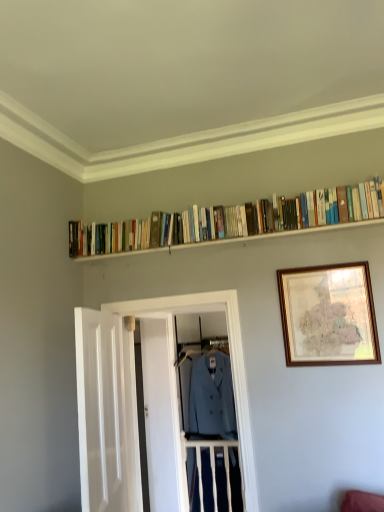
Question: Looking at their shapes, would you say white wooden door at center, the 2th door from the front, is wider or thinner than white wooden door at left, the first door when ordered from front to back?

Choices:
 (A) wide
 (B) thin

Answer: (A)

Question: From the image's perspective, is white wooden door at center, arranged as the first door when viewed from the back, above or below white wooden door at left, the first door when ordered from front to back?

Choices:
 (A) below
 (B) above

Answer: (A)

Question: Estimate the real-world distances between objects in this image. Which object is closer to the matte blue coat at center?

Choices:
 (A) hardcover books at upper center
 (B) white wooden door at center, arranged as the first door when viewed from the back
 (C) light blue fabric blazer at center
 (D) white wooden door at left, the first door when ordered from front to back
 (E) wooden framed map at upper right

Answer: (D)

Question: Considering the real-world distances, which object is farthest from the matte blue coat at center?

Choices:
 (A) light blue fabric blazer at center
 (B) wooden framed map at upper right
 (C) white wooden door at center, the 2th door from the front
 (D) hardcover books at upper center
 (E) white wooden door at left, positioned as the 2th door in back-to-front order

Answer: (A)